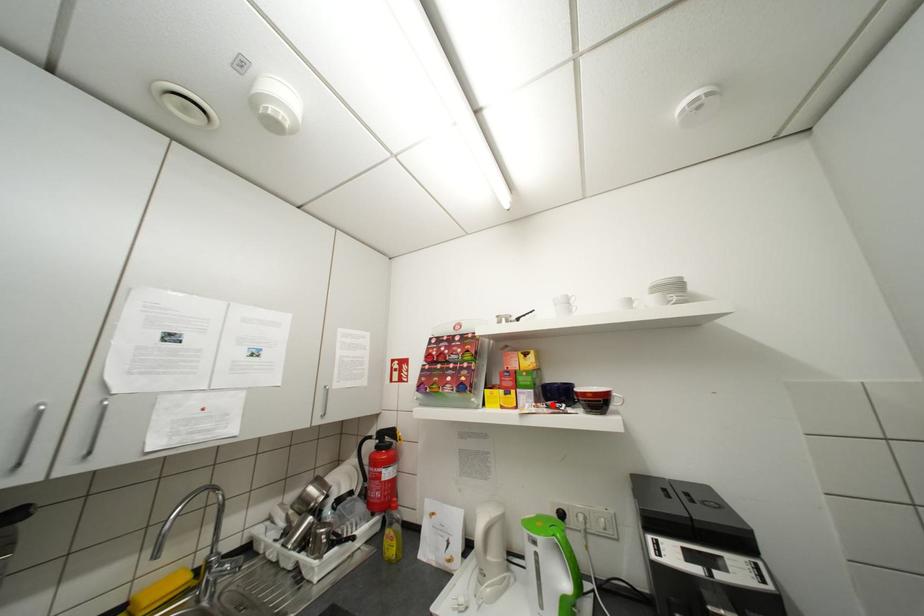
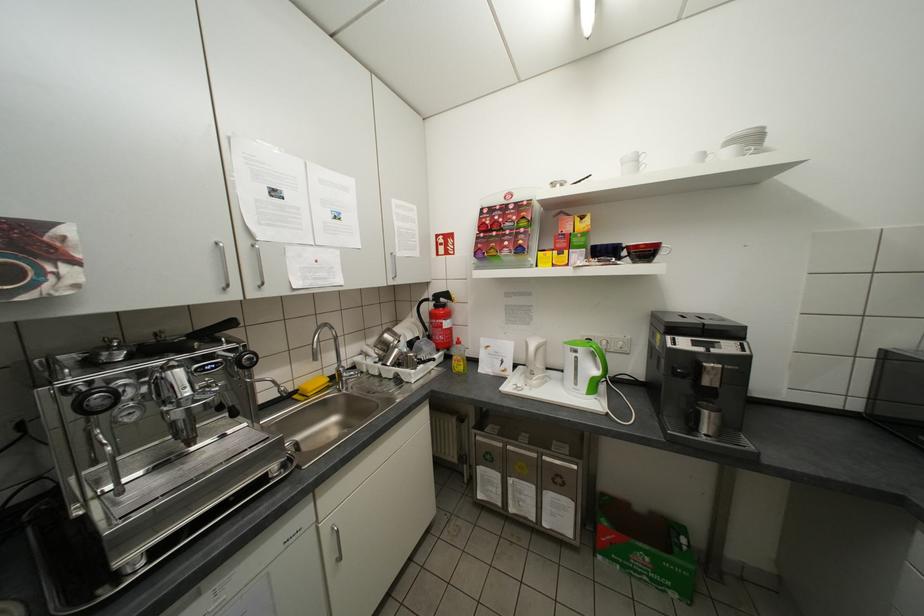
In the second image, find the point that corresponds to the highlighted location in the first image.

(603, 259)